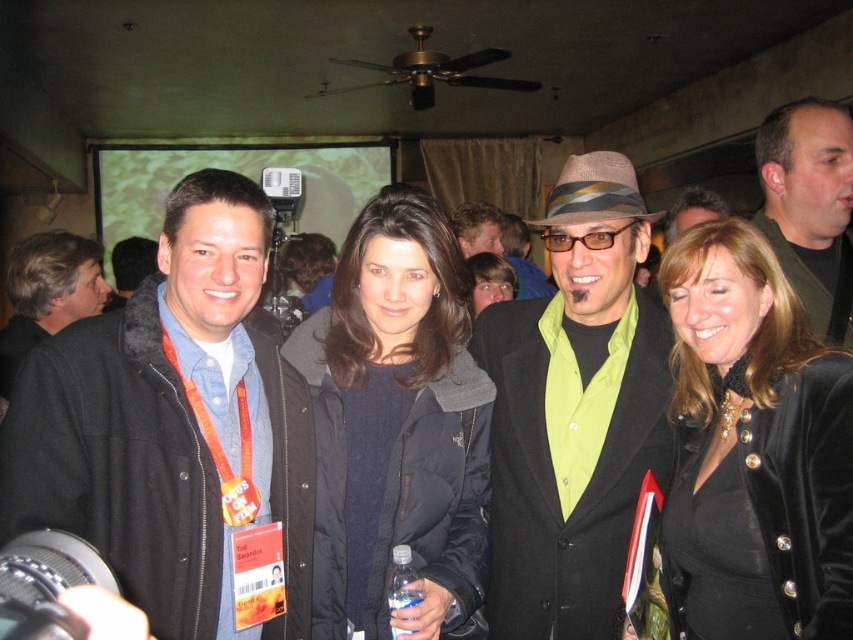
Can you confirm if black matte jacket at left is positioned below matte black coat at center?

Yes.

Does black matte jacket at left lie in front of matte black coat at center?

Yes.

Which is in front, point (196, 216) or point (578, 468)?

Positioned in front is point (196, 216).

I want to click on black matte jacket at left, so click(172, 422).

Is dark blue fleece jacket at center to the left of denim jacket at center from the viewer's perspective?

In fact, dark blue fleece jacket at center is to the right of denim jacket at center.

Who is more distant from viewer, (339, 576) or (132, 260)?

The point (132, 260) is behind.

Identify the location of dark blue fleece jacket at center. (396, 424).

Is matte black coat at center shorter than velvet black jacket at right?

No.

Is matte black coat at center bigger than velvet black jacket at right?

Yes, matte black coat at center is bigger than velvet black jacket at right.

Between point (473, 342) and point (828, 433), which one is positioned in front?

Point (828, 433)

Locate an element on the screen. matte black coat at center is located at coordinates (573, 412).